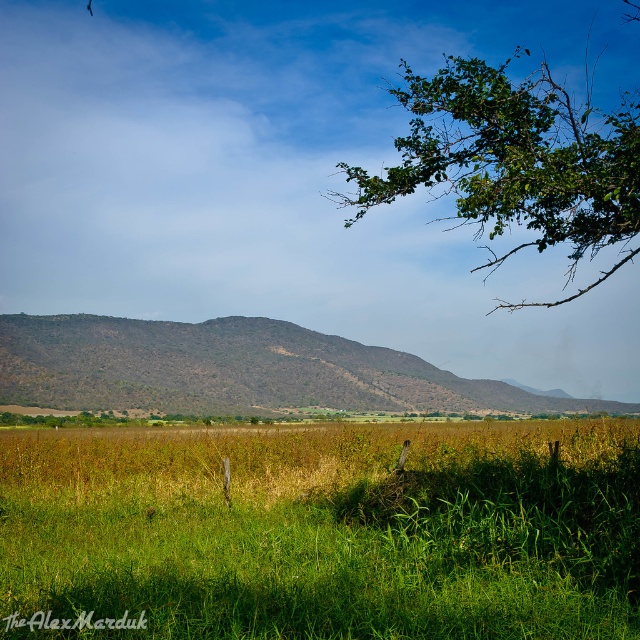
In the scene shown: Who is shorter, green grassy at center or green leafy branch at upper right?

green grassy at center

This screenshot has width=640, height=640. I want to click on green grassy at center, so click(x=321, y=531).

Between green grassy at center and brown/dry grassy at center, which one appears on the left side from the viewer's perspective?

green grassy at center is more to the left.

Between point (42, 500) and point (422, 381), which one is positioned behind?

Point (422, 381)

Is point (561, 600) closer to viewer compared to point (326, 337)?

Yes, it is.

Where is `green grassy at center`? This screenshot has height=640, width=640. green grassy at center is located at coordinates (321, 531).

Does brown/dry grassy at center appear under green leafy branch at upper right?

Yes.

Who is more forward, (x=467, y=380) or (x=490, y=252)?

Point (x=467, y=380) is more forward.

Identify the location of brown/dry grassy at center. (234, 369).